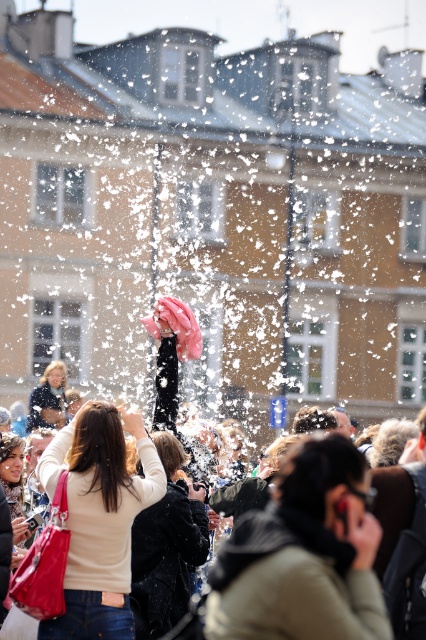
Question: Which is farther from the matte beige sweater at center?

Choices:
 (A) velvet black coat at center
 (B) light brown leather jacket at center

Answer: (B)

Question: Does light brown leather jacket at center have a lesser width compared to matte beige sweater at center?

Choices:
 (A) no
 (B) yes

Answer: (A)

Question: Which point appears closest to the camera in this image?

Choices:
 (A) (140, 605)
 (B) (71, 538)

Answer: (B)

Question: Can you confirm if matte beige sweater at center is positioned to the right of velvet black coat at center?

Choices:
 (A) yes
 (B) no

Answer: (B)

Question: Is the position of light brown leather jacket at center more distant than that of velvet black coat at center?

Choices:
 (A) no
 (B) yes

Answer: (A)

Question: Which object is closer to the camera taking this photo?

Choices:
 (A) matte black jacket at center
 (B) matte beige sweater at center
 (C) light brown leather jacket at center
 (D) velvet black coat at center

Answer: (C)